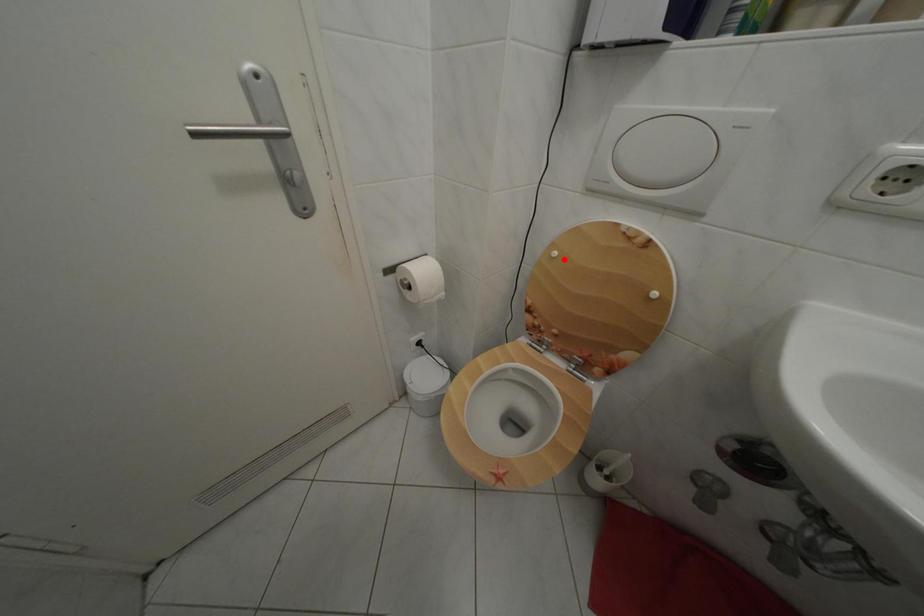
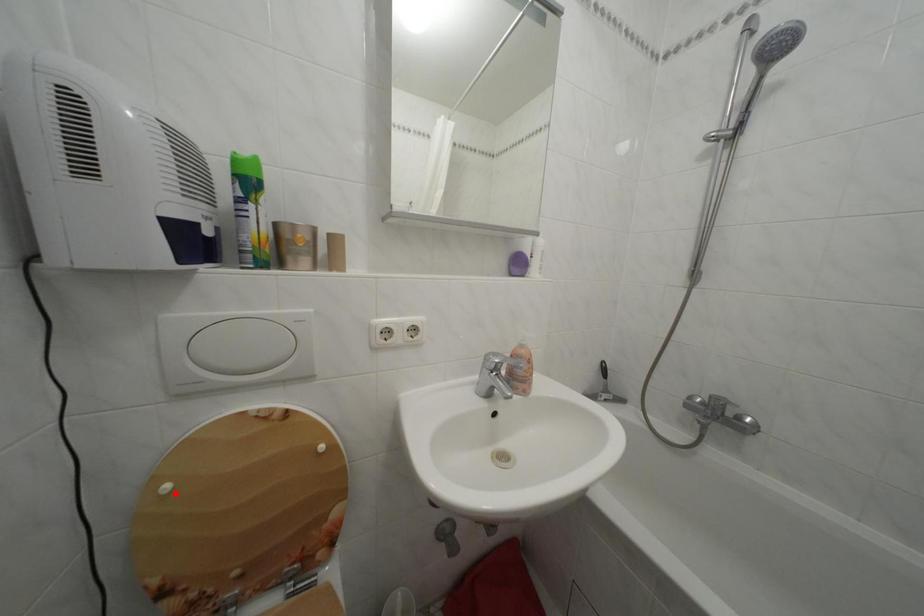
I am providing you with two images of the same scene from different viewpoints. A red point is marked on the first image and another point is marked on the second image. Is the marked point in image1 the same physical position as the marked point in image2?

Yes